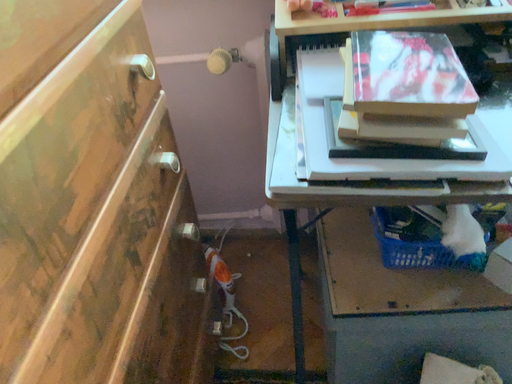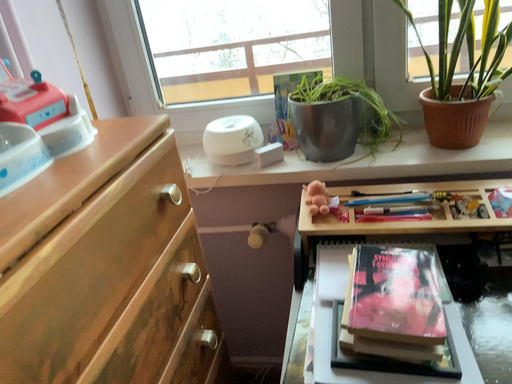
Question: Which way did the camera rotate in the video?

Choices:
 (A) rotated right
 (B) rotated left

Answer: (B)